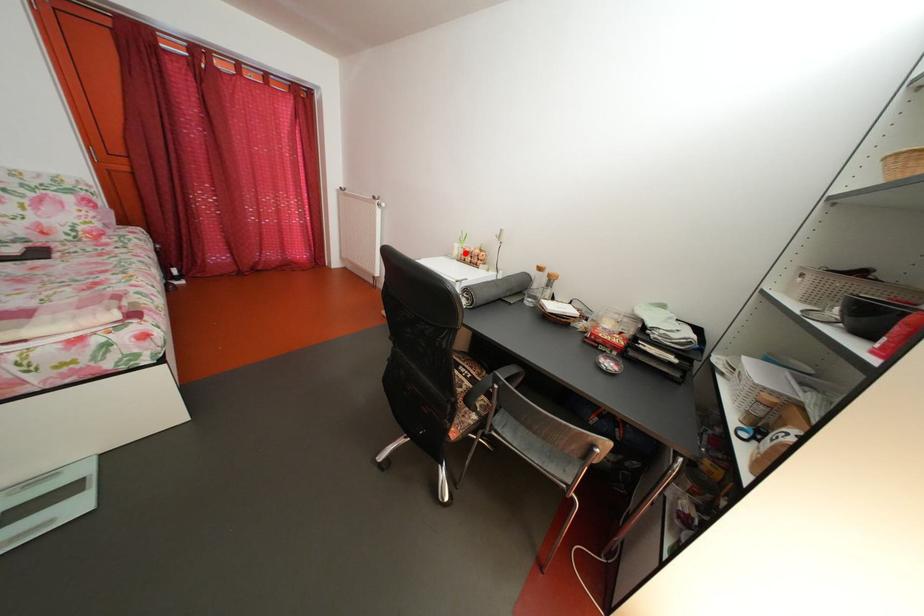
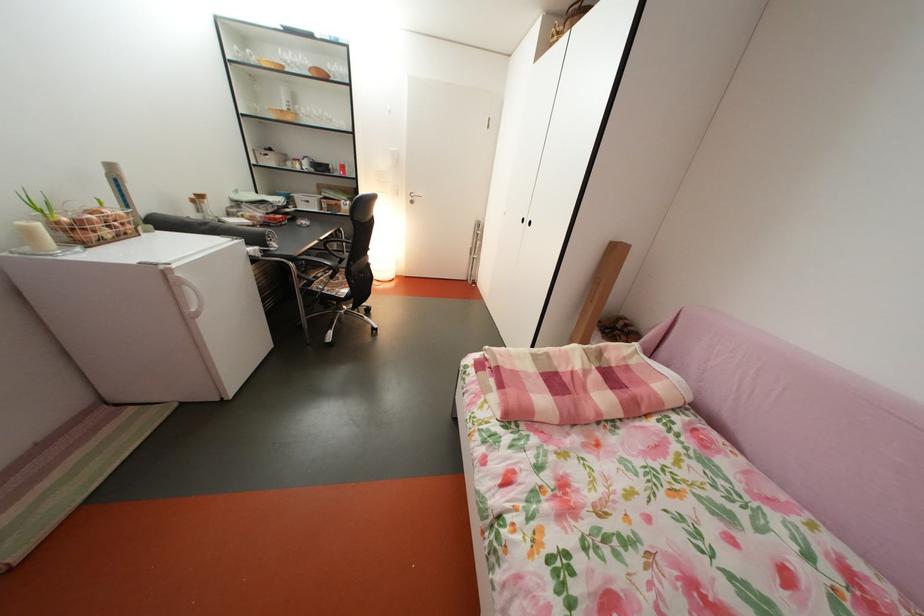
Where in the second image is the point corresponding to the highlighted location from the first image?

(41, 238)